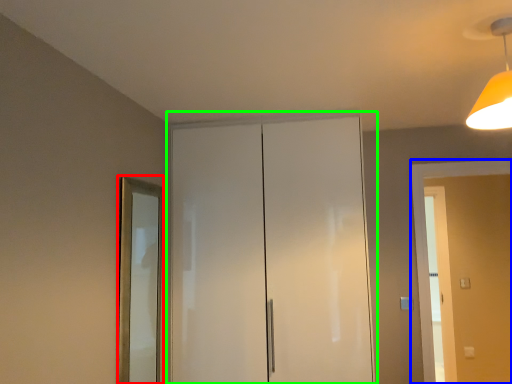
Question: Estimate the real-world distances between objects in this image. Which object is farther from mirror (highlighted by a red box), screen door (highlighted by a blue box) or dresser (highlighted by a green box)?

Choices:
 (A) screen door
 (B) dresser

Answer: (A)